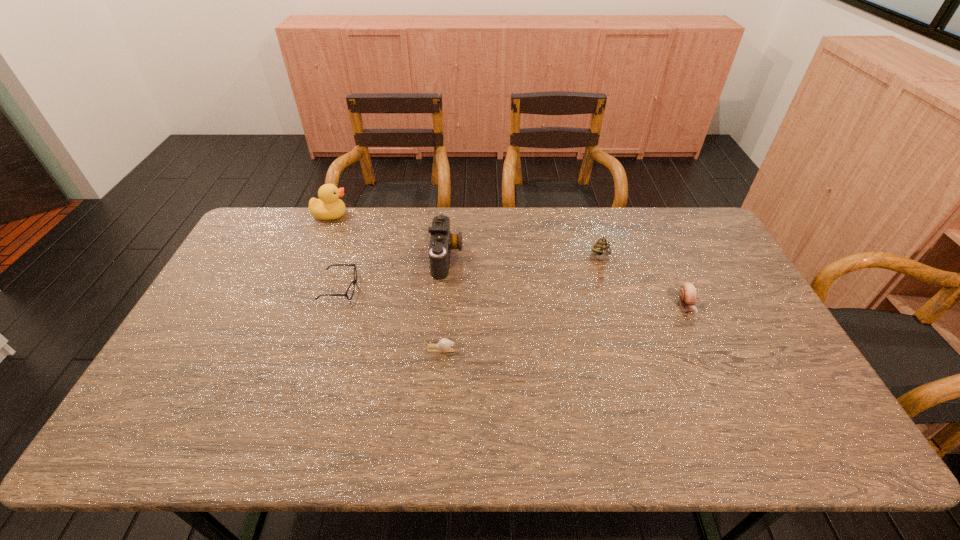
At what (x,y) coordinates should I click in order to perform the action: click on free space between the farthest object and the second shortest object. Please return your answer as a coordinate pair (x, y). Image resolution: width=960 pixels, height=540 pixels. Looking at the image, I should click on (335, 252).

Identify the location of vacant space that's between the rightmost object and the nearest object. (563, 328).

Locate an element on the screen. This screenshot has width=960, height=540. vacant space in between the duck and the second shortest object is located at coordinates (335, 252).

Find the location of a particular element. This screenshot has height=540, width=960. vacant space in between the rightmost escargot and the spectacles is located at coordinates (514, 298).

The height and width of the screenshot is (540, 960). Identify the location of free space that is in between the second tallest escargot and the duck. (509, 260).

Identify which object is located as the nearest to the rightmost object. Please provide its 2D coordinates. Your answer should be formatted as a tuple, i.e. [(x, y)], where the tuple contains the x and y coordinates of a point satisfying the conditions above.

[(602, 248)]

Locate which object is the third closest to the camera. Please provide its 2D coordinates. Your answer should be formatted as a tuple, i.e. [(x, y)], where the tuple contains the x and y coordinates of a point satisfying the conditions above.

[(328, 207)]

Locate an element on the screen. the second closest escargot to the second shortest object is located at coordinates (602, 248).

Choose which escargot is the second nearest neighbor to the second shortest escargot. Please provide its 2D coordinates. Your answer should be formatted as a tuple, i.e. [(x, y)], where the tuple contains the x and y coordinates of a point satisfying the conditions above.

[(444, 345)]

Where is `vacant position in the image that satisfies the following two spatial constraints: 1. on the face of the second escargot from right to left; 2. on the shell of the nearest escargot`? The height and width of the screenshot is (540, 960). vacant position in the image that satisfies the following two spatial constraints: 1. on the face of the second escargot from right to left; 2. on the shell of the nearest escargot is located at coordinates (629, 349).